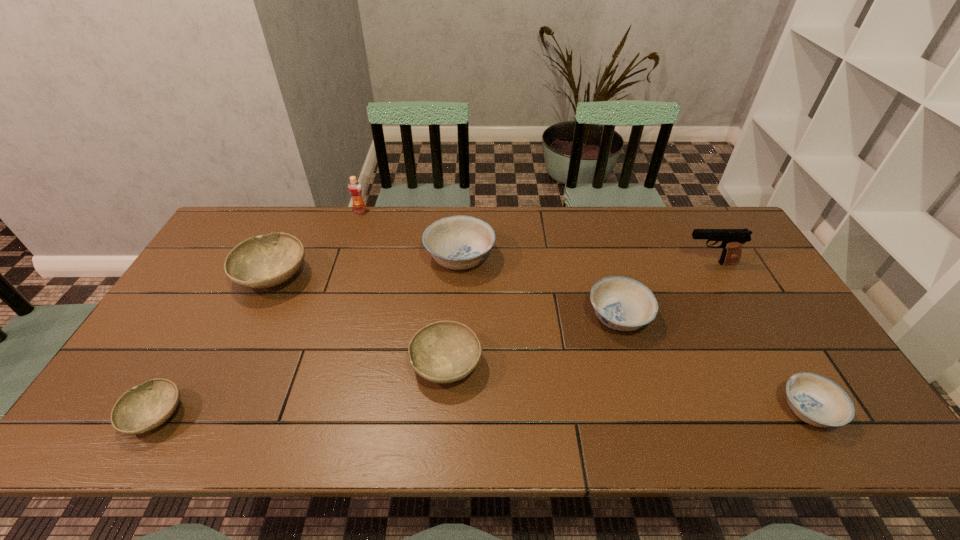
This screenshot has width=960, height=540. Find the location of `the rightmost bowl`. the rightmost bowl is located at coordinates (818, 401).

You are a GUI agent. You are given a task and a screenshot of the screen. Output one action in this format:
    pyautogui.click(x=<x>, y=<y>)
    Task: Click on the smallest gray bowl
    The width and height of the screenshot is (960, 540).
    Given the screenshot: What is the action you would take?
    pyautogui.click(x=144, y=407)

Find the location of a particular element. The height and width of the screenshot is (540, 960). free space located on the right of the third object from left to right is located at coordinates (436, 211).

This screenshot has width=960, height=540. I want to click on vacant space positioned 0.320m at the barrel of the black pistol, so click(580, 263).

Locate an element on the screen. The width and height of the screenshot is (960, 540). vacant space situated at the barrel of the black pistol is located at coordinates (605, 263).

Locate an element on the screen. vacant region located 0.200m at the barrel of the black pistol is located at coordinates (617, 263).

This screenshot has height=540, width=960. Find the location of `vacant space situated on the front of the leftmost blue bowl`. vacant space situated on the front of the leftmost blue bowl is located at coordinates (458, 295).

Find the location of a particular element. This screenshot has width=960, height=540. free location located on the front of the biggest gray bowl is located at coordinates (241, 343).

Find the location of a particular element. The image size is (960, 540). vacant space located on the left of the second bowl from right to left is located at coordinates (515, 317).

The height and width of the screenshot is (540, 960). I want to click on vacant space located on the left of the rightmost gray bowl, so click(x=359, y=364).